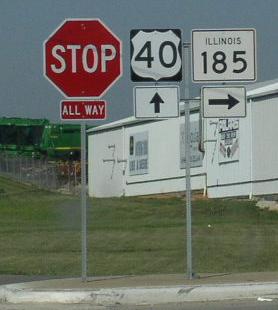
This screenshot has height=310, width=278. Identify the location of wall. (215, 183).